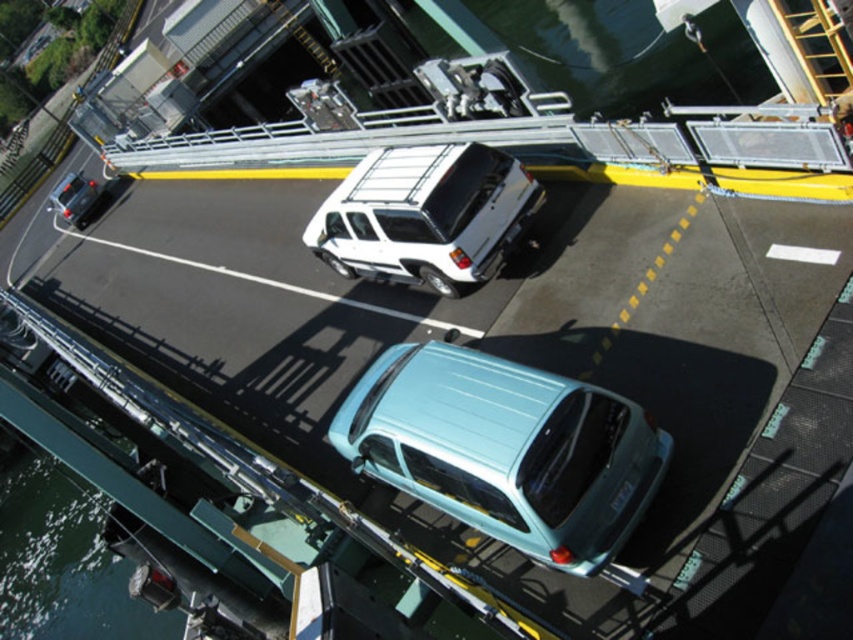
You are standing on the ferry deck and want to board a white matte truck at center. The ferry deck has yellow dashed lines and white lane dividers. Which direction should you walk to reach the white matte truck at center from your current position at point (425, 216)?

The white matte truck at center is represented by point (425, 216), so you are already at the location of the white matte truck at center.

You are a passenger on the ferry deck and want to take a photo of both the light blue matte hatchback at center and the white matte truck at center. To ensure both are in the frame, should you pan your camera to the left or right?

You should pan your camera to the right because the light blue matte hatchback at center is to the right of the white matte truck at center, so moving the camera to the right will capture both vehicles in the frame.

Consider the image. You are a passenger on the ferry deck and want to know which vehicle is shorter between the white matte truck at center and the matte black car at left. Can you tell me?

The white matte truck at center is not as tall as the matte black car at left, so the white matte truck at center is shorter.